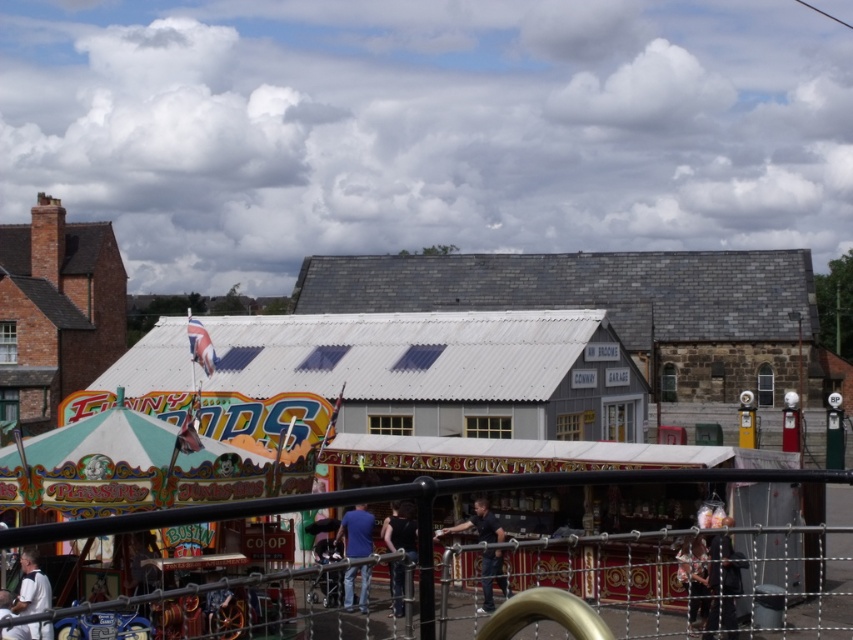
Where is the dark blue shirt at center located in the image?

The dark blue shirt at center is located at the 2D coordinates point (479, 524) in the image.

From the picture: You are standing at the point marked as point (651, 584) in the image. What object is directly in front of you?

The metallic chain link fence at lower center is directly in front of you at point (651, 584).

You are a photographer trying to capture a person wearing a dark blue shirt at center and dark blue jeans at center. If you want to ensure both the shirt and jeans are fully visible in your photo, which part of the person should you focus on to account for their width?

The dark blue shirt at center might be wider than dark blue jeans at center, so focusing on the shirt area would ensure both are visible since it is wider.